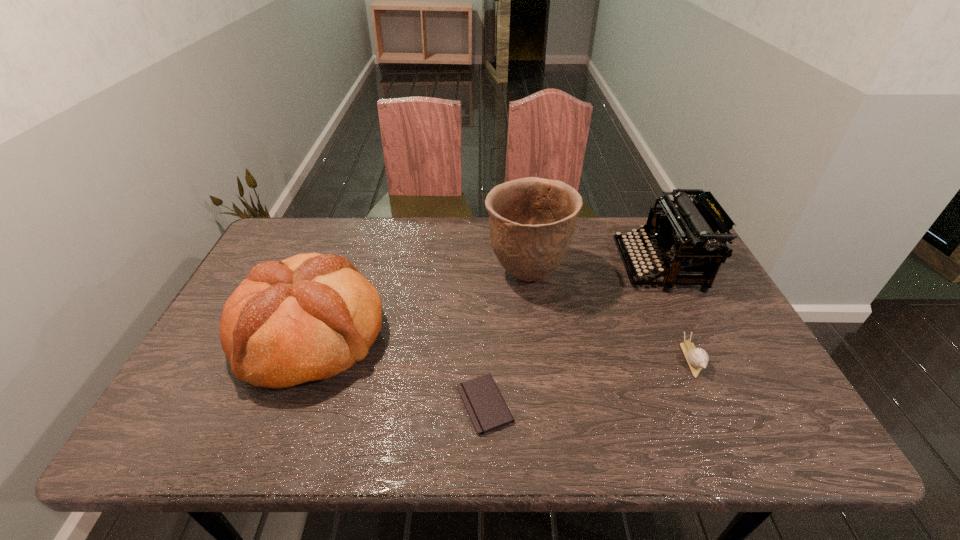
Identify the location of free space that is in between the leftmost object and the pottery. (419, 305).

Image resolution: width=960 pixels, height=540 pixels. Find the location of `empty space between the pottery and the escargot`. empty space between the pottery and the escargot is located at coordinates (610, 317).

The image size is (960, 540). Identify the location of free space between the bread and the pottery. (419, 305).

Find the location of a particular element. Image resolution: width=960 pixels, height=540 pixels. the second closest object to the leftmost object is located at coordinates (532, 220).

Identify which object is located as the third nearest to the typewriter. Please provide its 2D coordinates. Your answer should be formatted as a tuple, i.e. [(x, y)], where the tuple contains the x and y coordinates of a point satisfying the conditions above.

[(487, 410)]

Identify the location of free region that satisfies the following two spatial constraints: 1. on the front side of the leftmost object; 2. on the left side of the shortest object. The width and height of the screenshot is (960, 540). (284, 404).

This screenshot has width=960, height=540. I want to click on free region that satisfies the following two spatial constraints: 1. on the typing side of the typewriter; 2. on the front side of the pottery, so pyautogui.click(x=663, y=275).

Find the location of a particular element. This screenshot has height=540, width=960. free space that satisfies the following two spatial constraints: 1. on the typing side of the typewriter; 2. on the front side of the tallest object is located at coordinates (663, 275).

Locate an element on the screen. The width and height of the screenshot is (960, 540). vacant area that satisfies the following two spatial constraints: 1. on the typing side of the typewriter; 2. on the shell of the escargot is located at coordinates 704,359.

Identify the location of vacant space that satisfies the following two spatial constraints: 1. on the typing side of the typewriter; 2. on the shell of the escargot. This screenshot has width=960, height=540. (704, 359).